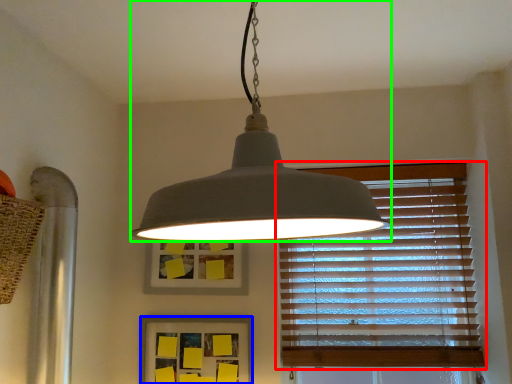
Question: Which object is positioned farthest from window blind (highlighted by a red box)? Select from picture frame (highlighted by a blue box) and lamp (highlighted by a green box).

Choices:
 (A) picture frame
 (B) lamp

Answer: (B)